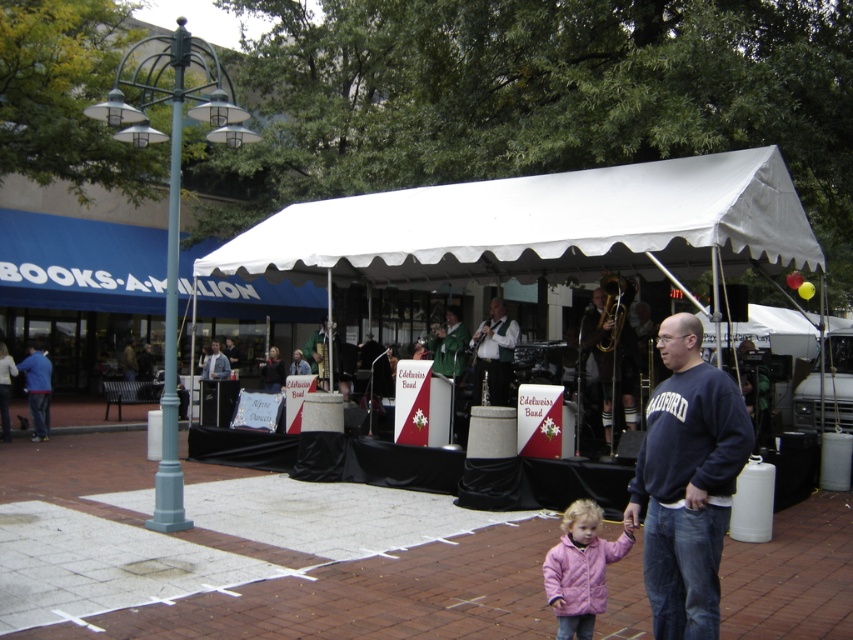
Based on the scene description, where is the point located at coordinates [538,225]?

The point at coordinates [538,225] corresponds to the white fabric canopy at center.

What is the significance of the point at coordinates (538, 225) in the image?

The point at coordinates (538, 225) marks the location of the white fabric tent at center.

Consider the image. You are attending the Edelweiss Band concert and want to take a photo of the shiny silver trumpet at center without the white fabric tent at center blocking the view. Is this possible from your current position?

The white fabric tent at center is in front of the shiny silver trumpet at center, so you cannot take a photo of the shiny silver trumpet at center without the white fabric tent at center blocking the view from your current position.